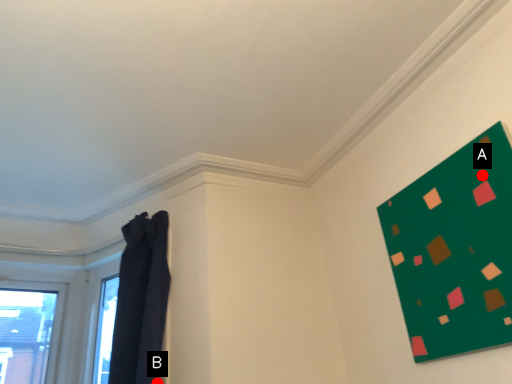
Question: Two points are circled on the image, labeled by A and B beside each circle. Which point is closer to the camera taking this photo?

Choices:
 (A) A is closer
 (B) B is closer

Answer: (A)